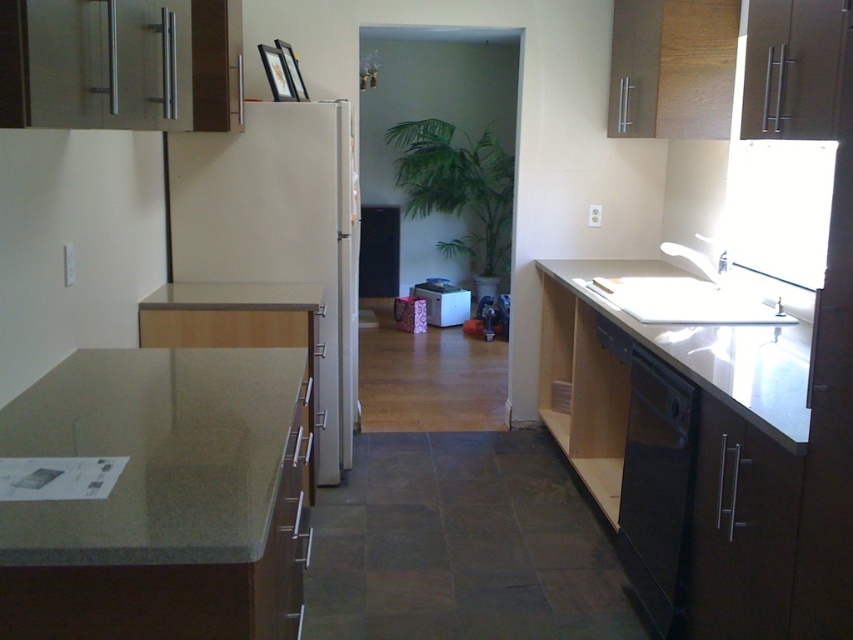
You are organizing a dinner party and need to place a large platter on the countertop. Which countertop between the granite countertop at lower left and the white glossy countertop at right can accommodate the platter if it requires a wider space?

The white glossy countertop at right has a greater width than the granite countertop at lower left, so it can accommodate the large platter that requires a wider space.

You are organizing the kitchen and need to place a tall appliance. The white glossy refrigerator at center is above the black matte dishwasher at lower right. Which appliance is positioned higher in the kitchen layout?

The white glossy refrigerator at center is positioned higher than the black matte dishwasher at lower right because it is located above it.

From the picture: You are standing in the kitchen and need to place a cutting board on the granite countertop at lower left. Based on its position at point 0.711, 0.183, can you estimate where exactly on the countertop you should place it?

The granite countertop at lower left is located at point (x=155, y=454), so placing the cutting board there would be appropriate.